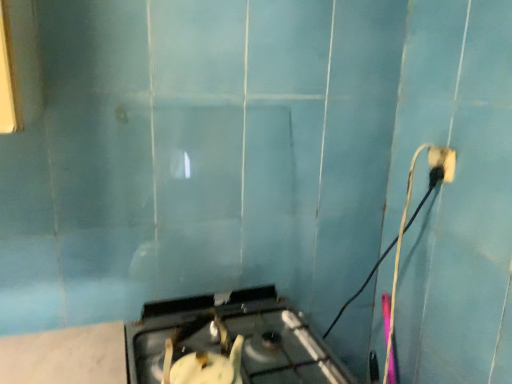
What do you see at coordinates (443, 161) in the screenshot? This screenshot has height=384, width=512. I see `black plastic power plug at upper right` at bounding box center [443, 161].

You are a GUI agent. You are given a task and a screenshot of the screen. Output one action in this format:
    pyautogui.click(x=<x>, y=<y>)
    Task: Click on the black plastic power plug at upper right
    The height and width of the screenshot is (384, 512).
    Given the screenshot: What is the action you would take?
    pyautogui.click(x=443, y=161)

At what (x,y) coordinates should I click in order to perform the action: click on metallic silver gas stove at center. Please return your answer as a coordinate pair (x, y). Looking at the image, I should click on (236, 335).

This screenshot has height=384, width=512. Describe the element at coordinates (236, 335) in the screenshot. I see `metallic silver gas stove at center` at that location.

What is the approximate height of metallic silver gas stove at center?

It is 8.18 inches.

The image size is (512, 384). I want to click on black plastic power plug at upper right, so click(x=443, y=161).

Which object is positioned more to the left, black plastic power plug at upper right or metallic silver gas stove at center?

metallic silver gas stove at center.

Is black plastic power plug at upper right positioned before metallic silver gas stove at center?

No, the depth of black plastic power plug at upper right is greater than that of metallic silver gas stove at center.

Is point (440, 165) less distant than point (318, 343)?

That is False.

From the image's perspective, is black plastic power plug at upper right on metallic silver gas stove at center?

Yes, from the image's perspective, black plastic power plug at upper right is above metallic silver gas stove at center.

From a real-world perspective, who is located higher, black plastic power plug at upper right or metallic silver gas stove at center?

In real-world perspective, black plastic power plug at upper right is above.

In terms of width, does black plastic power plug at upper right look wider or thinner when compared to metallic silver gas stove at center?

black plastic power plug at upper right is thinner than metallic silver gas stove at center.

Does black plastic power plug at upper right have a greater height compared to metallic silver gas stove at center?

No, black plastic power plug at upper right is not taller than metallic silver gas stove at center.

Looking at this image, is black plastic power plug at upper right smaller than metallic silver gas stove at center?

Yes, black plastic power plug at upper right is smaller than metallic silver gas stove at center.

Would you say metallic silver gas stove at center is part of black plastic power plug at upper right's contents?

No, metallic silver gas stove at center is located outside of black plastic power plug at upper right.

Is there a large distance between black plastic power plug at upper right and metallic silver gas stove at center?

No, black plastic power plug at upper right is not far from metallic silver gas stove at center.

Is black plastic power plug at upper right facing towards metallic silver gas stove at center?

Yes.

Measure the distance from black plastic power plug at upper right to metallic silver gas stove at center.

black plastic power plug at upper right is 28.28 inches away from metallic silver gas stove at center.

Where is `gas stove below the black plastic power plug at upper right (from a real-world perspective)`? gas stove below the black plastic power plug at upper right (from a real-world perspective) is located at coordinates (236, 335).

Can you confirm if metallic silver gas stove at center is positioned to the right of black plastic power plug at upper right?

In fact, metallic silver gas stove at center is to the left of black plastic power plug at upper right.

In the scene shown: Is metallic silver gas stove at center behind black plastic power plug at upper right?

No, the depth of metallic silver gas stove at center is less than that of black plastic power plug at upper right.

Which is behind, point (275, 320) or point (454, 156)?

The point (275, 320) is farther from the camera.

From the image's perspective, which is above, metallic silver gas stove at center or black plastic power plug at upper right?

black plastic power plug at upper right appears higher in the image.

From a real-world perspective, is metallic silver gas stove at center on top of black plastic power plug at upper right?

No, from a real-world perspective, metallic silver gas stove at center is not on top of black plastic power plug at upper right.

Looking at their sizes, would you say metallic silver gas stove at center is wider or thinner than black plastic power plug at upper right?

Considering their sizes, metallic silver gas stove at center looks broader than black plastic power plug at upper right.

Between metallic silver gas stove at center and black plastic power plug at upper right, which one has more height?

With more height is metallic silver gas stove at center.

Who is smaller, metallic silver gas stove at center or black plastic power plug at upper right?

black plastic power plug at upper right.

Consider the image. Does metallic silver gas stove at center contain black plastic power plug at upper right?

No, metallic silver gas stove at center does not contain black plastic power plug at upper right.

Is metallic silver gas stove at center next to black plastic power plug at upper right?

metallic silver gas stove at center is not next to black plastic power plug at upper right, and they're not touching.

Consider the image. Is metallic silver gas stove at center oriented towards black plastic power plug at upper right?

No, metallic silver gas stove at center is not oriented towards black plastic power plug at upper right.

Find the location of a particular element. The image size is (512, 384). power plugs and sockets above the metallic silver gas stove at center (from the image's perspective) is located at coordinates (443, 161).

In order to click on gas stove located below the black plastic power plug at upper right (from the image's perspective) in this screenshot , I will do `click(236, 335)`.

In order to click on gas stove below the black plastic power plug at upper right (from a real-world perspective) in this screenshot , I will do `click(236, 335)`.